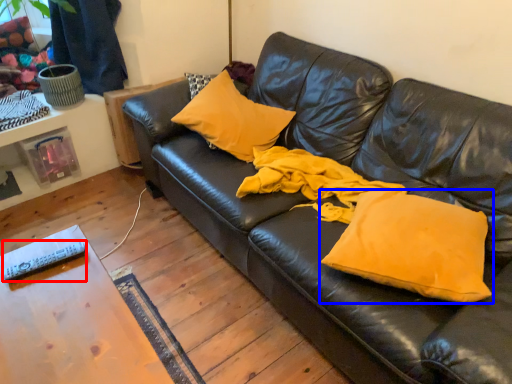
Question: Which point is further to the camera, remote (highlighted by a red box) or pillow (highlighted by a blue box)?

Choices:
 (A) remote
 (B) pillow

Answer: (A)